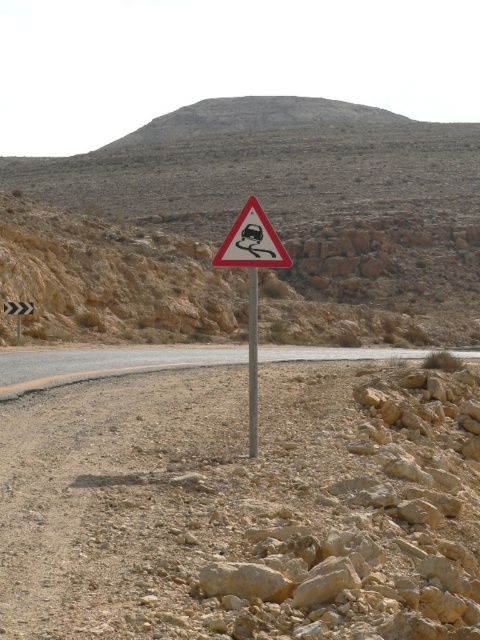
Can you confirm if gray asphalt road at center is positioned above yellow reflective chevron at center?

No, gray asphalt road at center is not above yellow reflective chevron at center.

Does gray asphalt road at center have a larger size compared to yellow reflective chevron at center?

Yes, gray asphalt road at center is bigger than yellow reflective chevron at center.

Does point (322, 355) lie in front of point (27, 307)?

Yes, point (322, 355) is in front of point (27, 307).

Image resolution: width=480 pixels, height=640 pixels. In order to click on gray asphalt road at center in this screenshot , I will do `click(101, 364)`.

Is dirt road at center shorter than gray asphalt road at center?

No, dirt road at center is not shorter than gray asphalt road at center.

Between dirt road at center and gray asphalt road at center, which one has more height?

dirt road at center

Who is more distant from viewer, [257,602] or [28,380]?

The point [28,380] is behind.

The height and width of the screenshot is (640, 480). In order to click on dirt road at center in this screenshot , I will do `click(243, 506)`.

Is point (249, 305) farther from camera compared to point (33, 301)?

No.

Can you confirm if metallic triangular sign at center is wider than yellow reflective chevron at center?

No.

Does point (256, 378) come in front of point (19, 312)?

Yes, point (256, 378) is closer to viewer.

You are a GUI agent. You are given a task and a screenshot of the screen. Output one action in this format:
    pyautogui.click(x=<x>, y=<y>)
    Task: Click on the metallic triangular sign at center
    The image size is (480, 640).
    Given the screenshot: What is the action you would take?
    pyautogui.click(x=252, y=282)